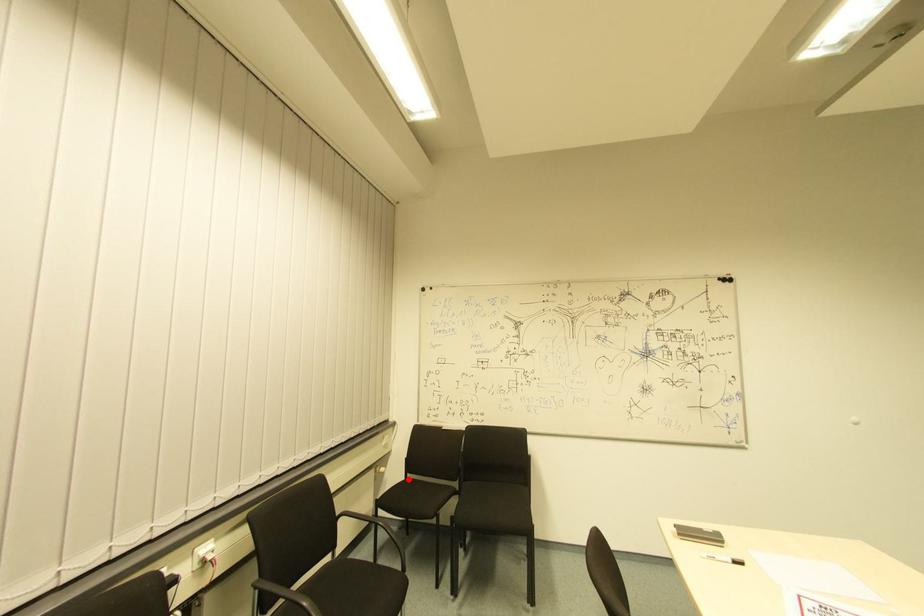
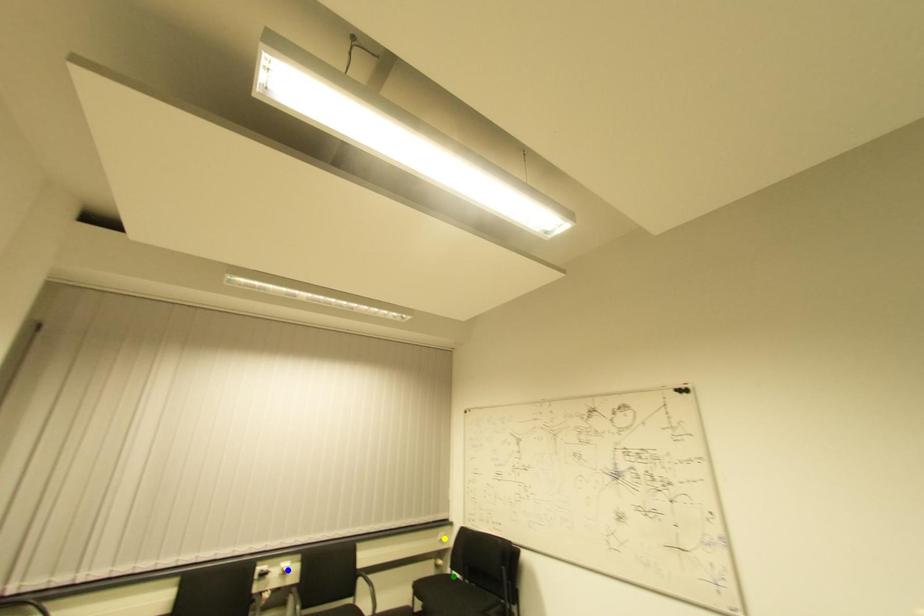
Question: I am providing you with two images of the same scene from different viewpoints. A red point is marked on the first image. You are given multiple points on the second image. Can you choose the point in image 2 that corresponds to the point in image 1?

Choices:
 (A) yellow point
 (B) blue point
 (C) green point

Answer: (C)